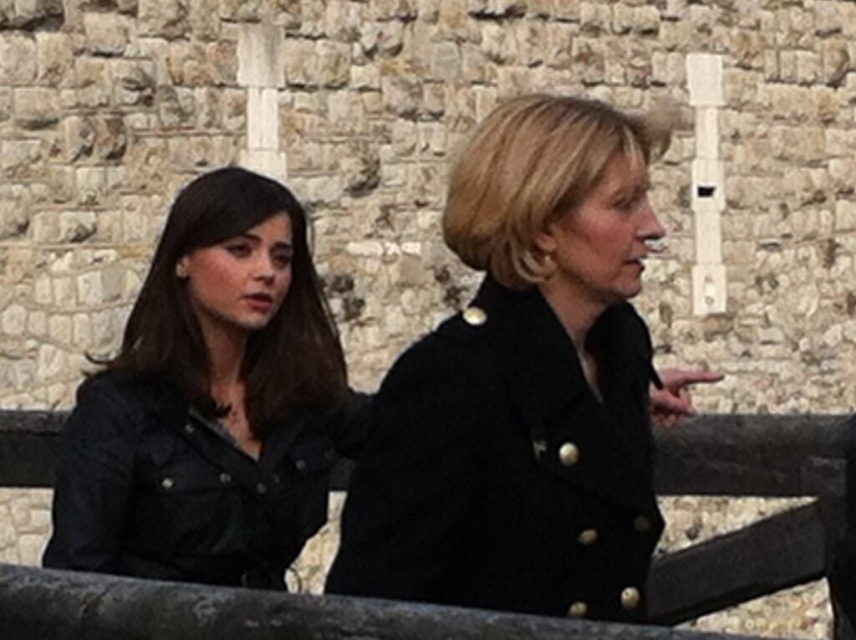
Question: Can you confirm if black matte coat at center is bigger than matte black jacket at left?

Choices:
 (A) yes
 (B) no

Answer: (A)

Question: Is black matte coat at center further to the viewer compared to smooth wooden fence at center?

Choices:
 (A) yes
 (B) no

Answer: (A)

Question: Among these objects, which one is farthest from the camera?

Choices:
 (A) smooth wooden fence at center
 (B) matte black jacket at left

Answer: (B)

Question: Considering the relative positions of black matte coat at center and matte black jacket at left in the image provided, where is black matte coat at center located with respect to matte black jacket at left?

Choices:
 (A) below
 (B) above

Answer: (B)

Question: Which point is farther to the camera?

Choices:
 (A) (738, 477)
 (B) (250, 317)

Answer: (B)

Question: Which of the following is the farthest from the observer?

Choices:
 (A) black matte coat at center
 (B) matte black jacket at left

Answer: (B)